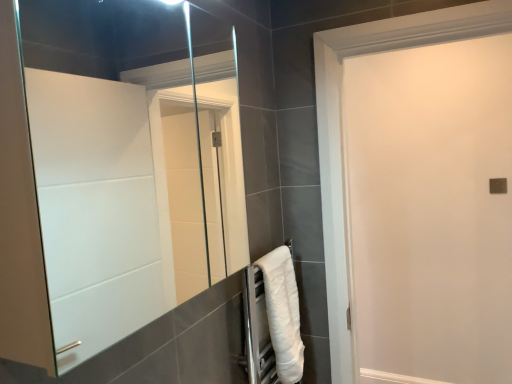
Find the location of a particular element. Image resolution: width=512 pixels, height=384 pixels. white matte door at center is located at coordinates (430, 211).

Could you tell me if white fluffy towel at lower right is turned towards clear glass mirror at center?

No, white fluffy towel at lower right is not facing towards clear glass mirror at center.

Which is in front, point (295, 302) or point (80, 29)?

The point (295, 302) is closer to the camera.

Is clear glass mirror at center surrounded by white fluffy towel at lower right?

Definitely not — clear glass mirror at center is not inside white fluffy towel at lower right.

What's the angular difference between white fluffy towel at lower right and clear glass mirror at center's facing directions?

white fluffy towel at lower right and clear glass mirror at center are facing 1.88 degrees away from each other.

From a real-world perspective, is clear glass mirror at center above or below white matte door at center?

In terms of real-world spatial position, clear glass mirror at center is above white matte door at center.

Between clear glass mirror at center and white matte door at center, which one has smaller width?

Thinner between the two is white matte door at center.

Consider the image. Which is further, (122, 219) or (359, 360)?

The point (359, 360) is farther from the camera.

Are clear glass mirror at center and white matte door at center far apart?

clear glass mirror at center is far away from white matte door at center.

Could you tell me if white matte door at center is facing clear glass mirror at center?

Yes, white matte door at center is oriented towards clear glass mirror at center.

Would you say white matte door at center contains clear glass mirror at center?

No, clear glass mirror at center is located outside of white matte door at center.

From the image's perspective, who appears lower, white matte door at center or clear glass mirror at center?

From the image's view, white matte door at center is below.

From a real-world perspective, is white matte door at center above or below clear glass mirror at center?

In terms of real-world spatial position, white matte door at center is below clear glass mirror at center.

Does point (270, 313) appear closer or farther from the camera than point (409, 208)?

Point (270, 313) appears to be closer to the viewer than point (409, 208).

Which is behind, white fluffy towel at lower right or white matte door at center?

Positioned behind is white fluffy towel at lower right.

From the image's perspective, which object appears higher, white fluffy towel at lower right or white matte door at center?

white matte door at center is shown above in the image.

Who is smaller, white matte door at center or white fluffy towel at lower right?

white fluffy towel at lower right is smaller.

In terms of height, does white matte door at center look taller or shorter compared to white fluffy towel at lower right?

In the image, white matte door at center appears to be taller than white fluffy towel at lower right.

Between white matte door at center and white fluffy towel at lower right, which one appears on the left side from the viewer's perspective?

white fluffy towel at lower right.

Is white matte door at center wider or thinner than white fluffy towel at lower right?

Considering their sizes, white matte door at center looks broader than white fluffy towel at lower right.

Is clear glass mirror at center smaller than white fluffy towel at lower right?

Actually, clear glass mirror at center might be larger than white fluffy towel at lower right.

This screenshot has width=512, height=384. I want to click on mirror above the white fluffy towel at lower right (from a real-world perspective), so click(130, 161).

From the image's perspective, would you say clear glass mirror at center is shown under white fluffy towel at lower right?

No, from the image's perspective, clear glass mirror at center is not beneath white fluffy towel at lower right.

Locate an element on the screen. This screenshot has height=384, width=512. mirror lying above the white fluffy towel at lower right (from the image's perspective) is located at coordinates (130, 161).

The image size is (512, 384). What are the coordinates of `screen door located behind the clear glass mirror at center` in the screenshot? It's located at (430, 211).

Considering their positions, is white matte door at center positioned further to clear glass mirror at center than white fluffy towel at lower right?

white matte door at center.

Based on the photo, looking at the image, which one is located further to clear glass mirror at center, white fluffy towel at lower right or white matte door at center?

white matte door at center is positioned further to the anchor clear glass mirror at center.

Which object lies further to the anchor point white matte door at center, clear glass mirror at center or white fluffy towel at lower right?

The object further to white matte door at center is white fluffy towel at lower right.

From the image, which object appears to be farther from white fluffy towel at lower right, clear glass mirror at center or white matte door at center?

white matte door at center is positioned further to the anchor white fluffy towel at lower right.

Which object lies nearer to the anchor point white fluffy towel at lower right, white matte door at center or clear glass mirror at center?

clear glass mirror at center.

Based on their spatial positions, is white fluffy towel at lower right or clear glass mirror at center closer to white matte door at center?

Among the two, clear glass mirror at center is located nearer to white matte door at center.

Find the location of a particular element. The width and height of the screenshot is (512, 384). screen door between clear glass mirror at center and white fluffy towel at lower right in the front-back direction is located at coordinates (430, 211).